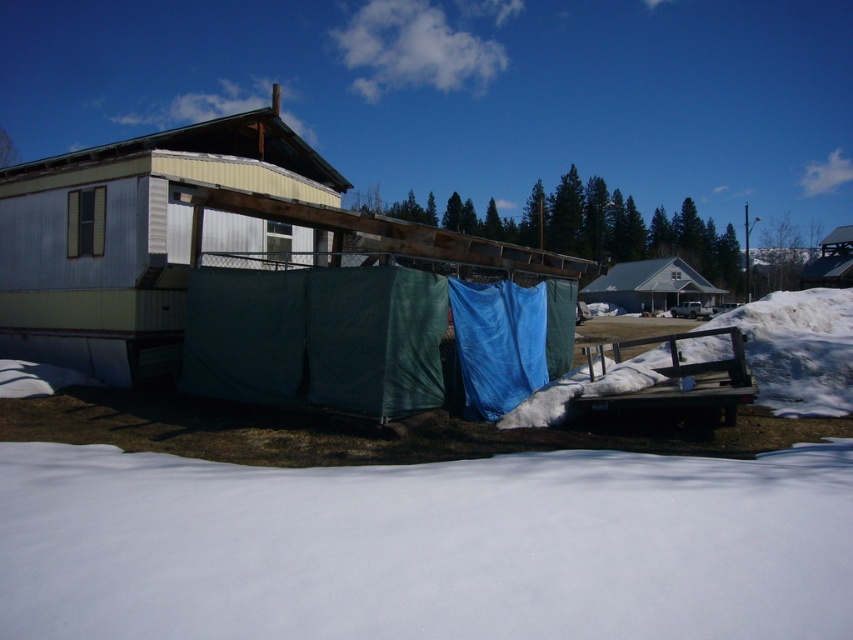
Between point (171, 342) and point (656, 300), which one is positioned in front?

Point (171, 342)

Does metal siding hut at left have a smaller size compared to white matte house at center?

No.

This screenshot has height=640, width=853. What do you see at coordinates (128, 237) in the screenshot?
I see `metal siding hut at left` at bounding box center [128, 237].

The width and height of the screenshot is (853, 640). I want to click on metal siding hut at left, so click(x=128, y=237).